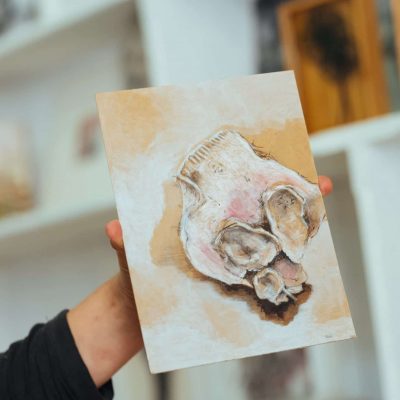
What are the coordinates of `canvas painting` in the screenshot? It's located at (196, 345).